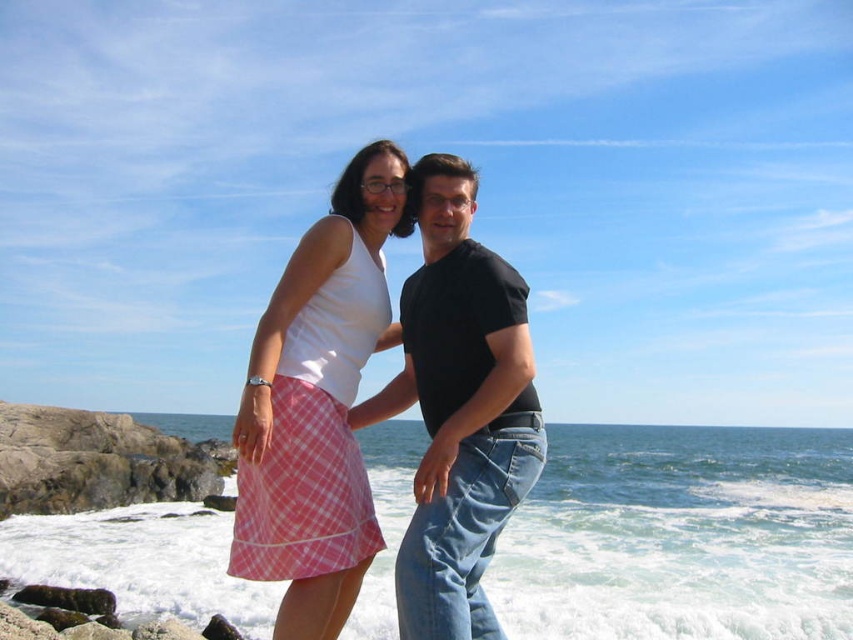
Question: Considering the relative positions of pink checkered skirt at center and black cotton t-shirt at center in the image provided, where is pink checkered skirt at center located with respect to black cotton t-shirt at center?

Choices:
 (A) below
 (B) above

Answer: (A)

Question: From the image, what is the correct spatial relationship of pink checkered skirt at center in relation to black cotton t-shirt at center?

Choices:
 (A) above
 (B) below

Answer: (B)

Question: Which object is farther from the camera taking this photo?

Choices:
 (A) pink checkered skirt at center
 (B) black cotton t-shirt at center

Answer: (A)

Question: Which object is closer to the camera taking this photo?

Choices:
 (A) pink checkered skirt at center
 (B) black cotton t-shirt at center

Answer: (B)

Question: Is pink checkered skirt at center below black cotton t-shirt at center?

Choices:
 (A) yes
 (B) no

Answer: (A)